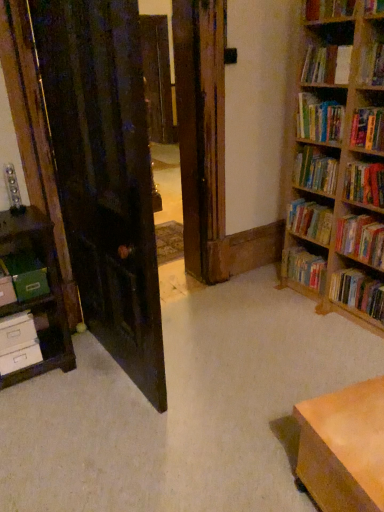
Locate an element on the screen. free space to the right of dark wood door at left is located at coordinates (221, 365).